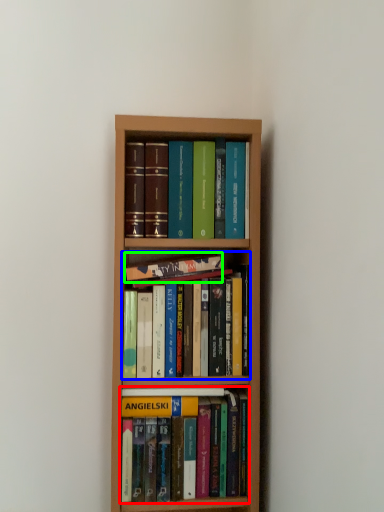
Question: Estimate the real-world distances between objects in this image. Which object is farther from book (highlighted by a red box), book (highlighted by a blue box) or book (highlighted by a green box)?

Choices:
 (A) book
 (B) book

Answer: (B)